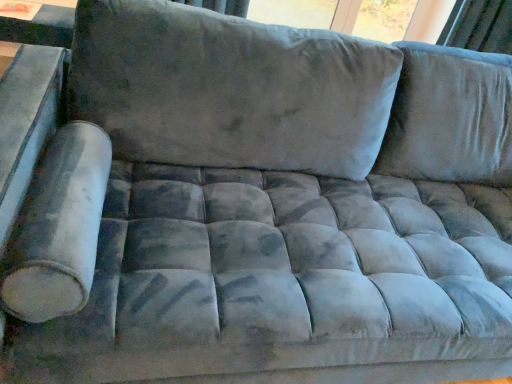
Question: Should I look upward or downward to see velvet curtain at upper right?

Choices:
 (A) down
 (B) up

Answer: (B)